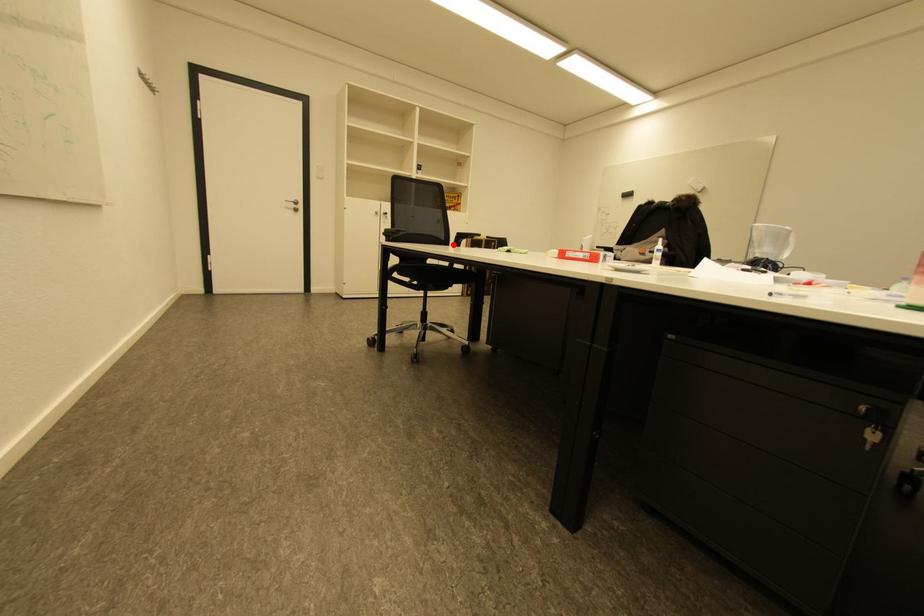
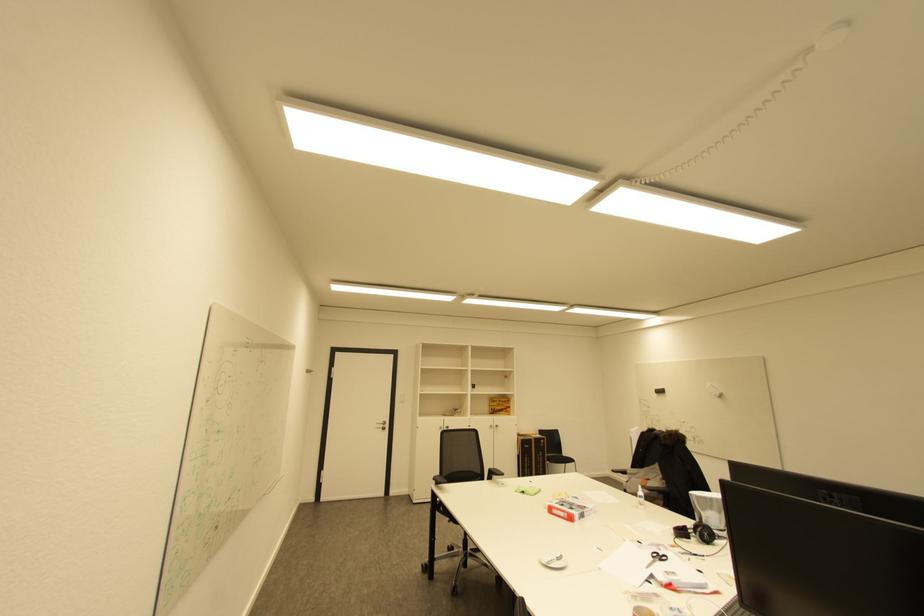
Find the pixel in the second image that matches the highlighted location in the first image.

(488, 479)